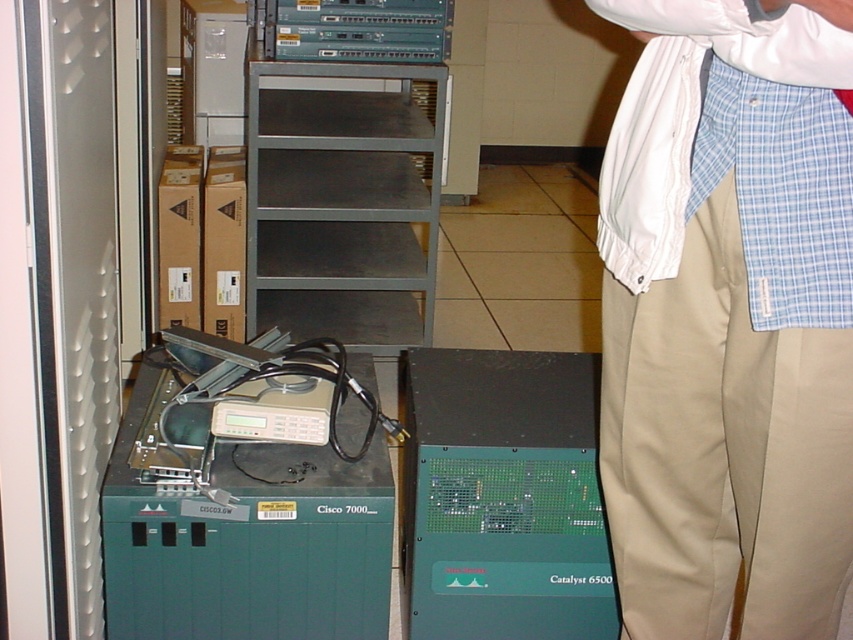
Question: Is khaki cotton pants at lower right bigger than green circuit board at center?

Choices:
 (A) no
 (B) yes

Answer: (B)

Question: Is khaki cotton pants at lower right bigger than green circuit board at center?

Choices:
 (A) no
 (B) yes

Answer: (B)

Question: Which object appears farthest from the camera in this image?

Choices:
 (A) khaki cotton pants at lower right
 (B) green circuit board at center

Answer: (B)

Question: Is khaki cotton pants at lower right further to the viewer compared to green circuit board at center?

Choices:
 (A) no
 (B) yes

Answer: (A)

Question: Which of the following is the closest to the observer?

Choices:
 (A) green circuit board at center
 (B) khaki cotton pants at lower right

Answer: (B)